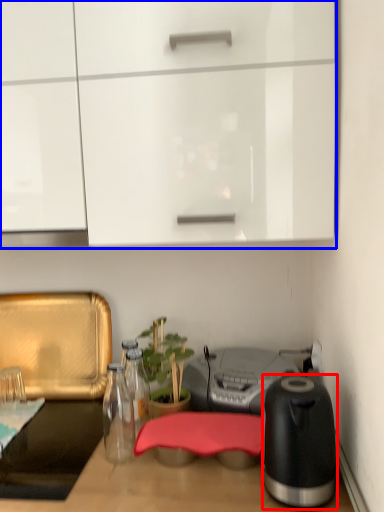
Question: Which of the following is the closest to the observer, kitchen appliance (highlighted by a red box) or cabinetry (highlighted by a blue box)?

Choices:
 (A) kitchen appliance
 (B) cabinetry

Answer: (A)